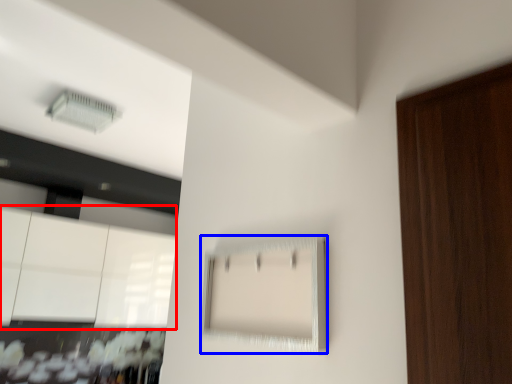
Question: Which object is closer to the camera taking this photo, cabinetry (highlighted by a red box) or cabinetry (highlighted by a blue box)?

Choices:
 (A) cabinetry
 (B) cabinetry

Answer: (B)